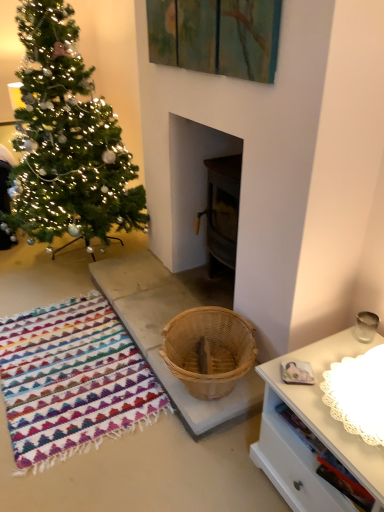
Identify the location of free location above multicolored woven rug at lower left (from a real-world perspective). Image resolution: width=384 pixels, height=512 pixels. (62, 361).